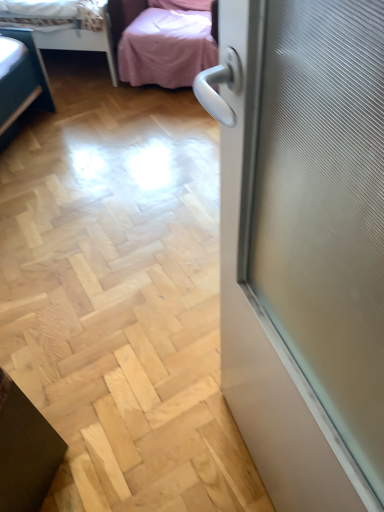
Question: Is pink fabric studio couch at upper center behind pink fabric bed at upper left?

Choices:
 (A) no
 (B) yes

Answer: (A)

Question: Is pink fabric studio couch at upper center facing towards pink fabric bed at upper left?

Choices:
 (A) no
 (B) yes

Answer: (A)

Question: From a real-world perspective, is pink fabric studio couch at upper center physically above pink fabric bed at upper left?

Choices:
 (A) yes
 (B) no

Answer: (A)

Question: Can you confirm if pink fabric studio couch at upper center is bigger than pink fabric bed at upper left?

Choices:
 (A) yes
 (B) no

Answer: (B)

Question: Is pink fabric studio couch at upper center located outside pink fabric bed at upper left?

Choices:
 (A) no
 (B) yes

Answer: (B)

Question: Is pink fabric studio couch at upper center looking in the opposite direction of pink fabric bed at upper left?

Choices:
 (A) no
 (B) yes

Answer: (A)

Question: Does pink fabric bed at upper left have a lesser width compared to pink fabric studio couch at upper center?

Choices:
 (A) no
 (B) yes

Answer: (A)

Question: Are pink fabric bed at upper left and pink fabric studio couch at upper center located far from each other?

Choices:
 (A) yes
 (B) no

Answer: (B)

Question: Is pink fabric bed at upper left in front of pink fabric studio couch at upper center?

Choices:
 (A) yes
 (B) no

Answer: (B)

Question: Is pink fabric studio couch at upper center at the back of pink fabric bed at upper left?

Choices:
 (A) no
 (B) yes

Answer: (A)

Question: Considering the relative positions of pink fabric bed at upper left and pink fabric studio couch at upper center in the image provided, is pink fabric bed at upper left to the left of pink fabric studio couch at upper center from the viewer's perspective?

Choices:
 (A) yes
 (B) no

Answer: (A)

Question: Is pink fabric bed at upper left aimed at pink fabric studio couch at upper center?

Choices:
 (A) no
 (B) yes

Answer: (B)

Question: Looking at the image, does pink fabric bed at upper left seem bigger or smaller compared to pink fabric studio couch at upper center?

Choices:
 (A) big
 (B) small

Answer: (A)